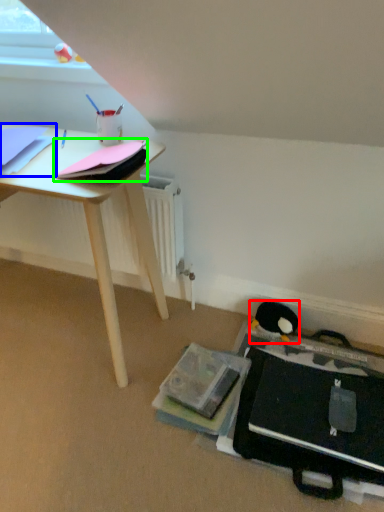
Question: Based on their relative distances, which object is farther from penguin (highlighted by a red box)? Choose from paperback book (highlighted by a blue box) and paperback book (highlighted by a green box).

Choices:
 (A) paperback book
 (B) paperback book

Answer: (A)